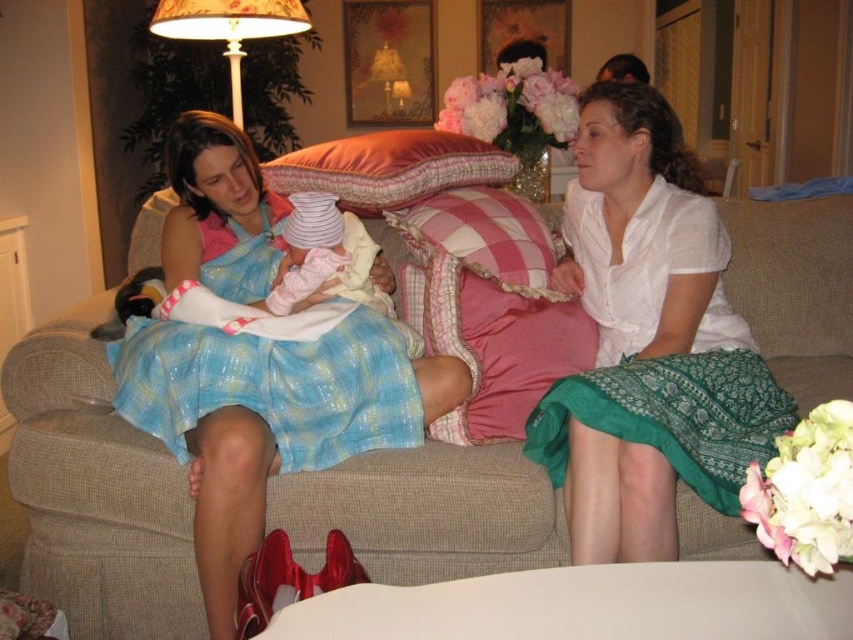
You are a tailor who needs to measure the distance between the white cotton shirt at center and the blue plaid dress at center to ensure proper alterations. Can you confirm if the distance between them is sufficient for your measuring tape, which requires at least 20 inches of space?

The white cotton shirt at center and blue plaid dress at center are 21.93 inches apart from each other, which is more than the required 20 inches. Therefore, the measuring tape can be used comfortably between them.

You are a photographer setting up a shot of the beige fabric couch at center and the pink plaid pillow at center. Which object should you focus on first if you want to capture both in sharp focus?

You should focus on the beige fabric couch at center first because it is closer to the viewer than the pink plaid pillow at center, ensuring both will be in focus when using depth of field techniques.

You are standing in the living room and want to place a small plant between the two points, point [96,612] and point [340,216]. Which point should the plant be closer to in order to be closer to the viewer?

The plant should be closer to point [96,612] because it is closer to the viewer than point [340,216].